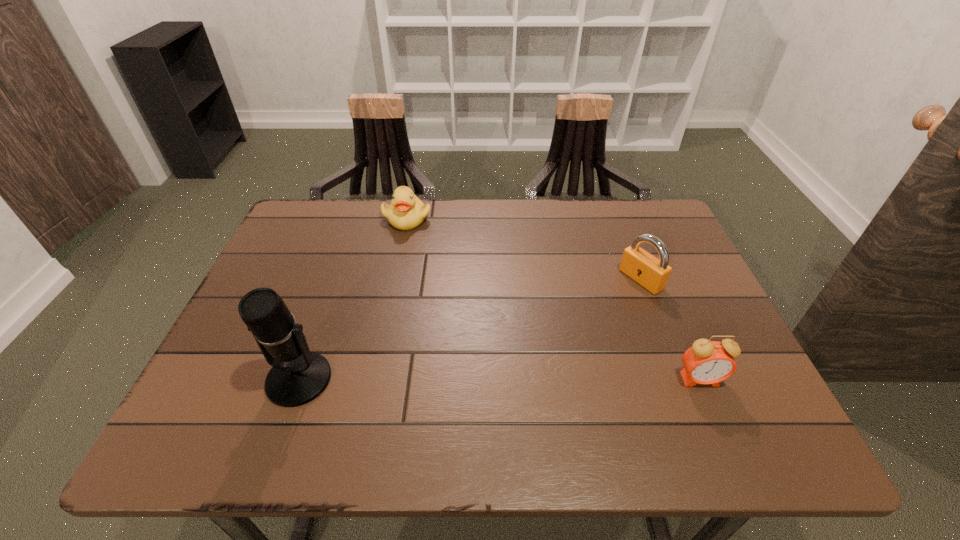
Where is `vacant space on the desktop that is between the microphone and the alarm clock and is positioned to unlock the padlock from the front`? Image resolution: width=960 pixels, height=540 pixels. vacant space on the desktop that is between the microphone and the alarm clock and is positioned to unlock the padlock from the front is located at coordinates (472, 380).

The height and width of the screenshot is (540, 960). Find the location of `vacant space on the desktop that is between the microphone and the alarm clock and is positioned on the front-facing side of the duckling`. vacant space on the desktop that is between the microphone and the alarm clock and is positioned on the front-facing side of the duckling is located at coordinates (516, 380).